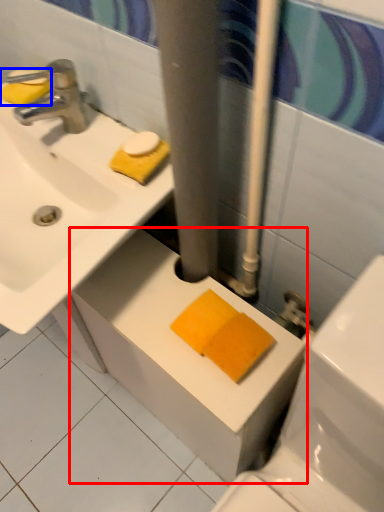
Question: Which object is closer to the camera taking this photo, counter top (highlighted by a red box) or soap (highlighted by a blue box)?

Choices:
 (A) counter top
 (B) soap

Answer: (A)